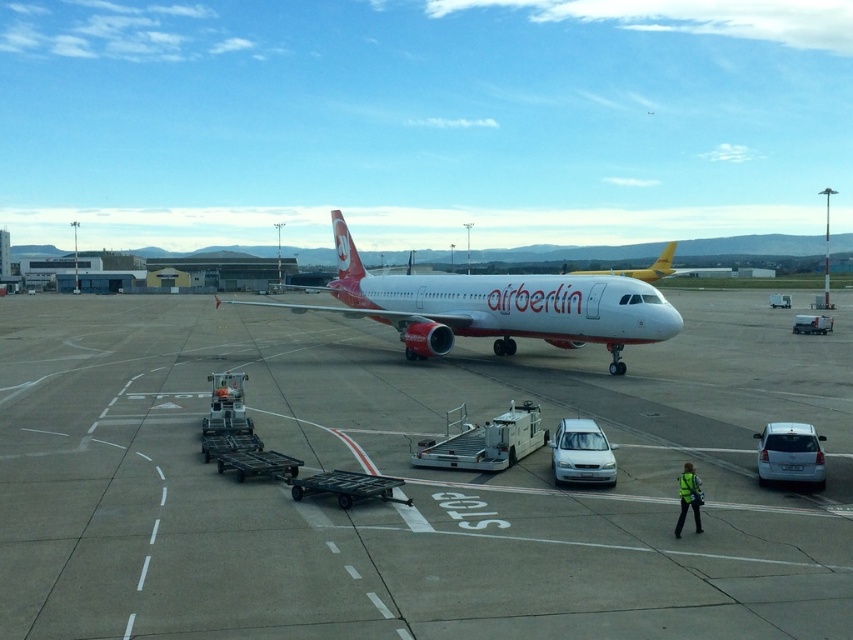
Which is above, white smooth tarmac at center or yellow metallic airplane at center?

yellow metallic airplane at center

In the scene shown: Is white smooth tarmac at center bigger than yellow metallic airplane at center?

Incorrect, white smooth tarmac at center is not larger than yellow metallic airplane at center.

Between point (9, 634) and point (630, 275), which one is positioned in front?

Point (9, 634)

Identify the location of white smooth tarmac at center. (405, 484).

Between white glossy airplane at center and yellow metallic airplane at center, which one appears on the left side from the viewer's perspective?

From the viewer's perspective, white glossy airplane at center appears more on the left side.

The width and height of the screenshot is (853, 640). Find the location of `white glossy airplane at center`. white glossy airplane at center is located at coordinates (495, 307).

The width and height of the screenshot is (853, 640). In order to click on white glossy airplane at center in this screenshot , I will do `click(495, 307)`.

The width and height of the screenshot is (853, 640). I want to click on white glossy airplane at center, so click(495, 307).

Who is positioned more to the right, white smooth tarmac at center or white glossy airplane at center?

Positioned to the right is white smooth tarmac at center.

Is white smooth tarmac at center to the left of white glossy airplane at center from the viewer's perspective?

Incorrect, white smooth tarmac at center is not on the left side of white glossy airplane at center.

Is point (126, 513) in front of point (636, 339)?

Yes, it is in front of point (636, 339).

I want to click on white smooth tarmac at center, so click(x=405, y=484).